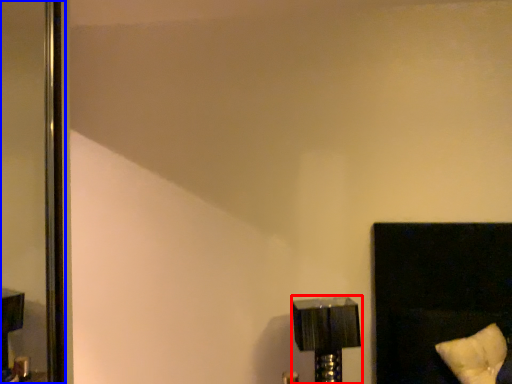
Question: Which object is further to the camera taking this photo, lamp (highlighted by a red box) or screen door (highlighted by a blue box)?

Choices:
 (A) lamp
 (B) screen door

Answer: (B)